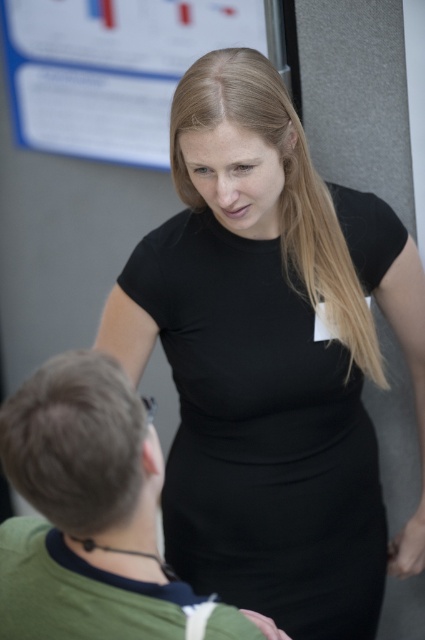
Question: Which point is closer to the camera?

Choices:
 (A) blue paper at upper center
 (B) black matte dress at center
 (C) green matte shirt at lower left

Answer: (C)

Question: Is black matte dress at center behind green matte shirt at lower left?

Choices:
 (A) yes
 (B) no

Answer: (A)

Question: Which point appears closest to the camera in this image?

Choices:
 (A) (88, 476)
 (B) (207, 44)

Answer: (A)

Question: Can you confirm if black matte dress at center is positioned below blue paper at upper center?

Choices:
 (A) no
 (B) yes

Answer: (B)

Question: Is black matte dress at center to the left of blue paper at upper center from the viewer's perspective?

Choices:
 (A) no
 (B) yes

Answer: (A)

Question: Among these objects, which one is nearest to the camera?

Choices:
 (A) blue paper at upper center
 (B) green matte shirt at lower left

Answer: (B)